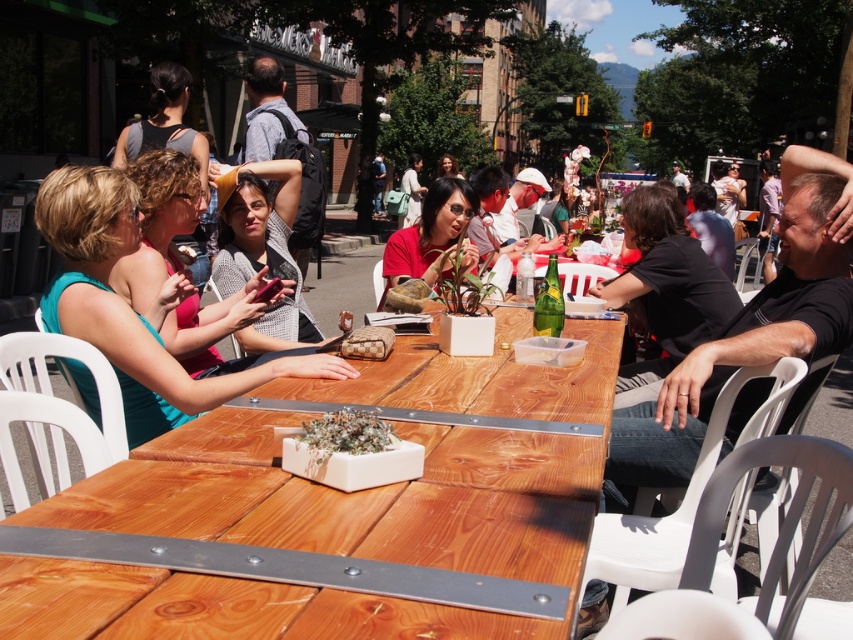
Question: Can you confirm if matte teal dress at left is smaller than black matte shirt at upper right?

Choices:
 (A) yes
 (B) no

Answer: (A)

Question: Which object is the closest to the black matte shirt at right?

Choices:
 (A) matte red shirt at center
 (B) white matte planter at center
 (C) black matte shirt at upper right
 (D) wooden table at center

Answer: (C)

Question: Which object is the closest to the knitted gray sweater at center?

Choices:
 (A) matte red shirt at center
 (B) wooden table at center
 (C) black matte shirt at upper right
 (D) matte teal dress at left

Answer: (D)

Question: Considering the relative positions of matte teal dress at left and white matte planter at center in the image provided, where is matte teal dress at left located with respect to white matte planter at center?

Choices:
 (A) above
 (B) below

Answer: (A)

Question: Which point appears farthest from the camera in this image?

Choices:
 (A) pos(339,424)
 (B) pos(461,444)

Answer: (B)

Question: Considering the relative positions of black matte shirt at right and white matte planter at center in the image provided, where is black matte shirt at right located with respect to white matte planter at center?

Choices:
 (A) below
 (B) above

Answer: (B)